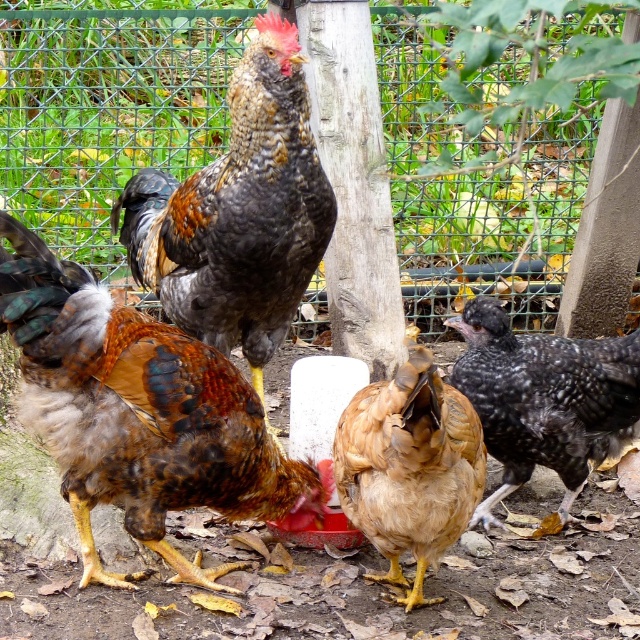
You are a farmer checking the coop and notice the speckled feathered rooster at center and the golden feathered chicken at center. Which one has a greater width?

The speckled feathered rooster at center has a greater width than the golden feathered chicken at center.

You are a farmer who needs to place a 20 inch wide feeding tray between the brown speckled feathers at center and the golden feathered chicken at center. Will there be enough space for the feeding tray between them?

The distance between the brown speckled feathers at center and the golden feathered chicken at center is 18.53 inches. Since the feeding tray is 20 inches wide, it will not fit between them as the space is narrower than the tray.

You are a chicken in the backyard and want to reach the fence to peck at some leaves. You are currently at point (x=268, y=333). There is another chicken at point (x=477, y=419). Which chicken is closer to the fence?

Point (x=268, y=333) is behind point (x=477, y=419), so the chicken at point (x=477, y=419) is closer to the fence.